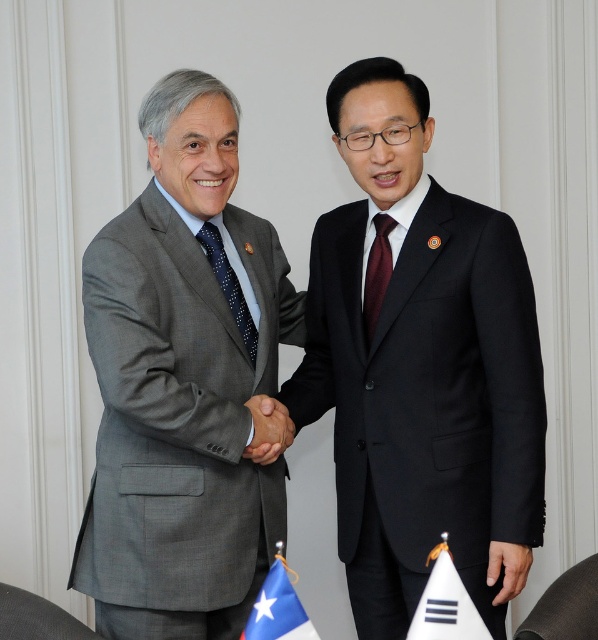
You are standing in front of the scene and want to locate the matte black suit at center. Based on the coordinates provided in the Objects Description, can you determine its position relative to the image frame?

The matte black suit at center is located at coordinates point [419,364], which places it near the lower central part of the image frame.

You are a photographer taking a picture of the two men shaking hands. You need to ensure that both the white fabric flag at lower center and the blue dotted tie at center are clearly visible in the frame. Given their distance apart, can you fit both into the same photo without cropping either of them?

The white fabric flag at lower center and blue dotted tie at center are 78.52 centimeters apart from each other. Since this distance is within the typical framing capabilities of a photographer, both objects can be included in the same photo without cropping.

You are a photographer at a formal event. You need to capture a photo where the white fabric flag at lower center and the blue dotted tie at center are both visible. Based on their sizes, which object will appear smaller in the photo?

The white fabric flag at lower center is shorter than the blue dotted tie at center, so it will appear smaller in the photo.